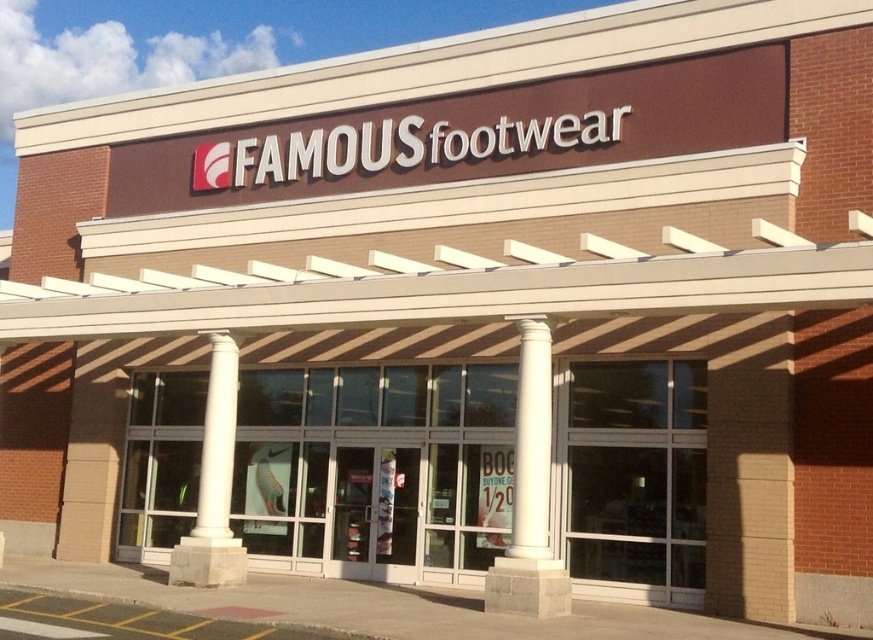
You are standing in front of the store entrance and want to walk between the white concrete column at center and the white marble column at center. Which column should you move to your left to pass through?

To pass between them, you should move to the left of the white marble column at center since the white concrete column at center is on its right side.

You are standing at the entrance of the Famous Footwear store and want to walk towards the two points marked in the image. Which point, point [540,360] or point [232,561], will you reach first?

You will reach point [540,360] first because it is closer to you than point [232,561].